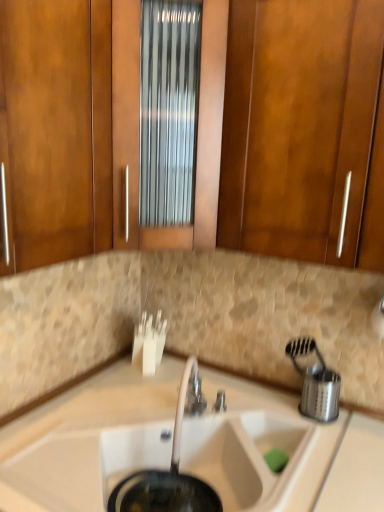
You are a GUI agent. You are given a task and a screenshot of the screen. Output one action in this format:
    pyautogui.click(x=<x>, y=<y>)
    Task: Click on the vacant space situated on the left part of white ceramic faucet at center
    This screenshot has height=512, width=384.
    Given the screenshot: What is the action you would take?
    pyautogui.click(x=140, y=420)